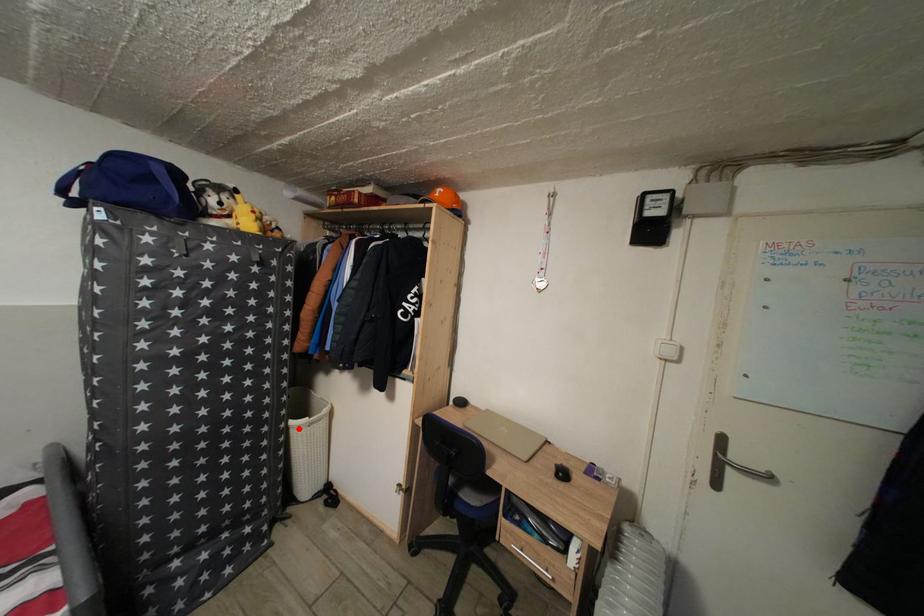
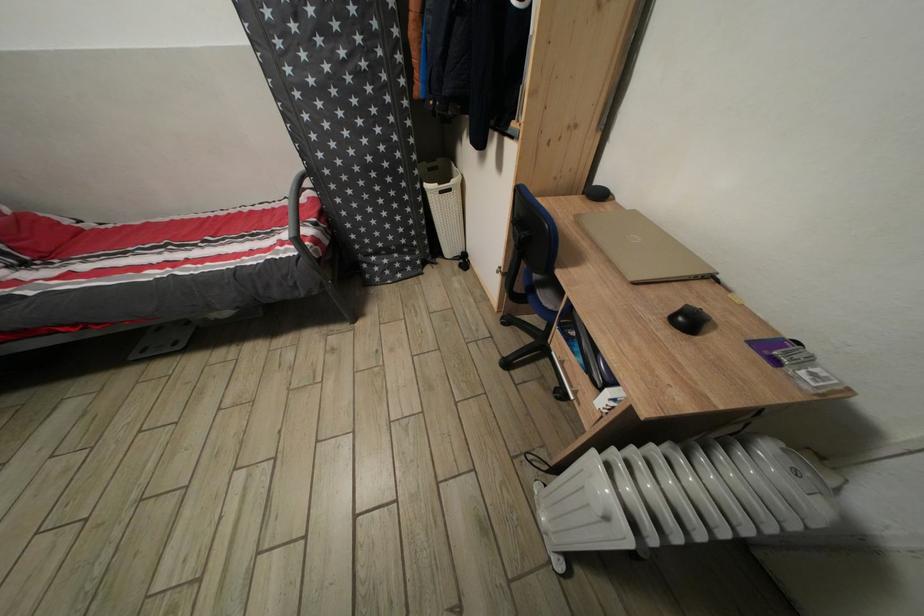
Find the pixel in the second image that matches the highlighted location in the first image.

(432, 192)